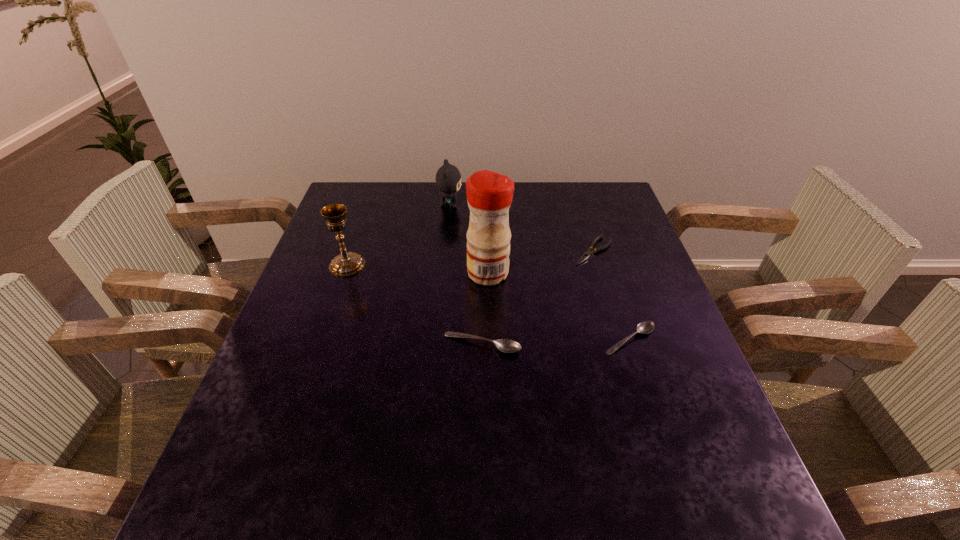
Please point a spot on the left to add another soupspoon. Please provide its 2D coordinates. Your answer should be formatted as a tuple, i.e. [(x, y)], where the tuple contains the x and y coordinates of a point satisfying the conditions above.

[(331, 349)]